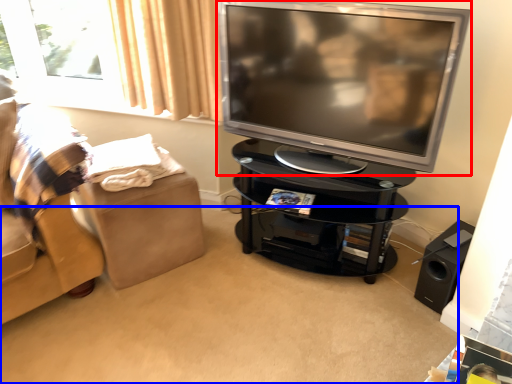
Question: Which object appears closest to the camera in this image, television (highlighted by a red box) or plain (highlighted by a blue box)?

Choices:
 (A) television
 (B) plain

Answer: (B)